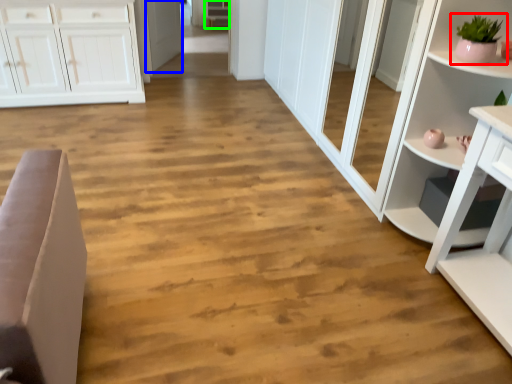
Question: Considering the real-world distances, which object is closest to houseplant (highlighted by a red box)? door (highlighted by a blue box) or cabinetry (highlighted by a green box).

Choices:
 (A) door
 (B) cabinetry

Answer: (A)